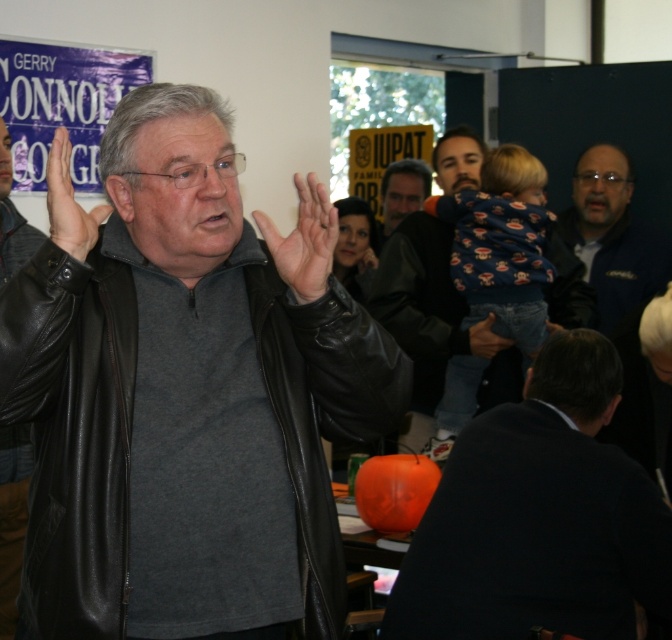
Based on the scene description, which object takes up more space in the image? The leather jacket at center or the smooth gray shirt at center?

The smooth gray shirt at center takes up more space than the leather jacket at center because the leather jacket at center occupies less space than smooth gray shirt at center.